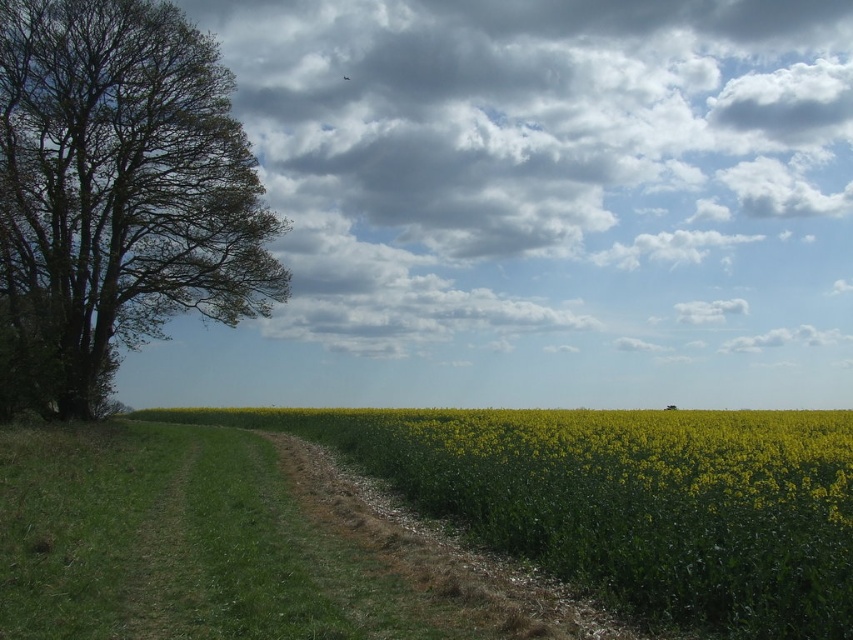
You are standing on the dirt path and want to take a photo of the cloudy sky at upper center and the green leafy tree at left. Which object will appear larger in your camera viewfinder?

The cloudy sky at upper center will appear larger in the camera viewfinder because it is closer to the viewer than the green leafy tree at left.

You are standing at the point marked by point (544,161) in the image. Looking around, what do you see above you?

The point (544,161) marks cloudy sky at upper center, so above you would be the cloudy sky at upper center.